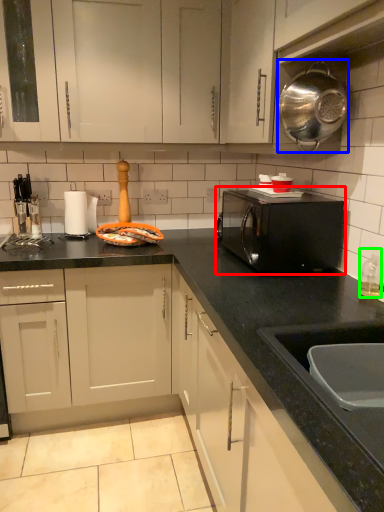
Question: Which object is positioned farthest from home appliance (highlighted by a red box)? Select from kitchen appliance (highlighted by a blue box) and bottle (highlighted by a green box).

Choices:
 (A) kitchen appliance
 (B) bottle

Answer: (A)